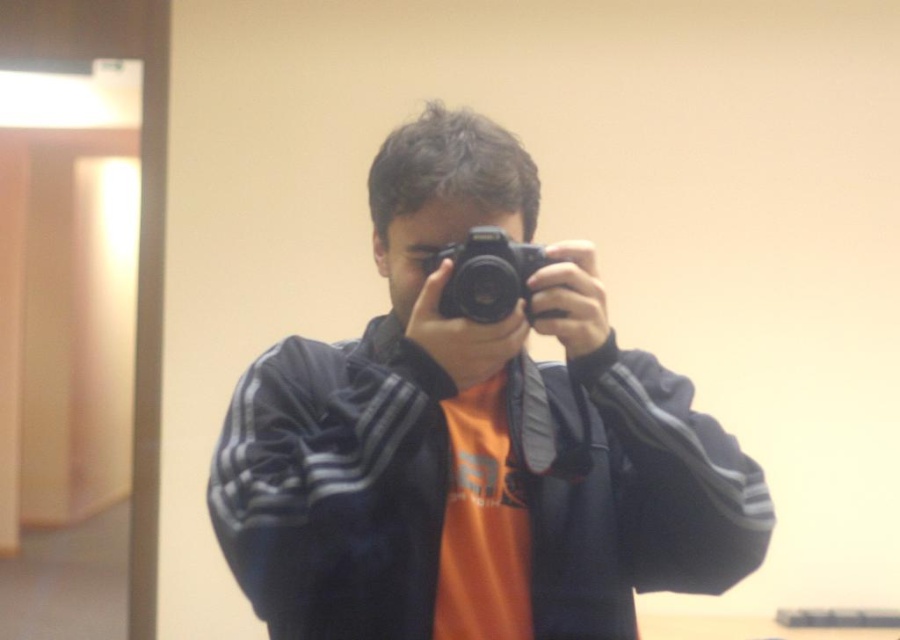
Question: Which object is closer to the camera taking this photo?

Choices:
 (A) black matte camera at center
 (B) black plastic camera at center

Answer: (B)

Question: Is black matte camera at center wider than black plastic camera at center?

Choices:
 (A) no
 (B) yes

Answer: (B)

Question: Among these objects, which one is nearest to the camera?

Choices:
 (A) black plastic camera at center
 (B) black matte camera at center

Answer: (A)

Question: Considering the relative positions of black matte camera at center and black plastic camera at center in the image provided, where is black matte camera at center located with respect to black plastic camera at center?

Choices:
 (A) left
 (B) right

Answer: (A)

Question: Is black matte camera at center closer to the viewer compared to black plastic camera at center?

Choices:
 (A) yes
 (B) no

Answer: (B)